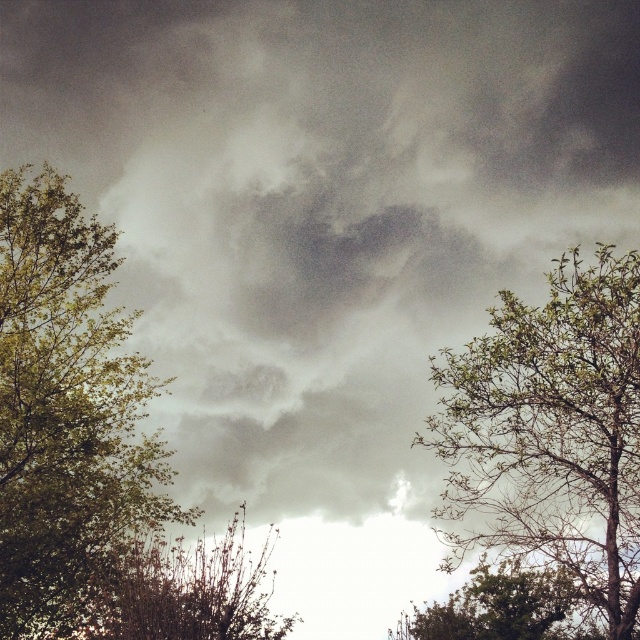
Consider the image. Which is more to the right, brown textured bush at lower left or green leafy tree at lower right?

From the viewer's perspective, green leafy tree at lower right appears more on the right side.

From the picture: Is brown textured bush at lower left below green leafy tree at lower right?

Yes.

Is point (260, 628) positioned before point (513, 598)?

No.

Image resolution: width=640 pixels, height=640 pixels. Identify the location of brown textured bush at lower left. (193, 589).

Is point (540, 346) more distant than point (544, 637)?

No.

Between green leafy tree at right and green leafy tree at lower right, which one has more height?

Standing taller between the two is green leafy tree at right.

This screenshot has width=640, height=640. I want to click on green leafy tree at right, so click(550, 432).

The height and width of the screenshot is (640, 640). Find the location of `green leafy tree at right`. green leafy tree at right is located at coordinates (550, 432).

Can you confirm if green leafy tree at left is shorter than green leafy tree at lower right?

Incorrect, green leafy tree at left's height does not fall short of green leafy tree at lower right's.

Is green leafy tree at left positioned behind green leafy tree at lower right?

Yes, it is.

The image size is (640, 640). I want to click on green leafy tree at left, so click(65, 412).